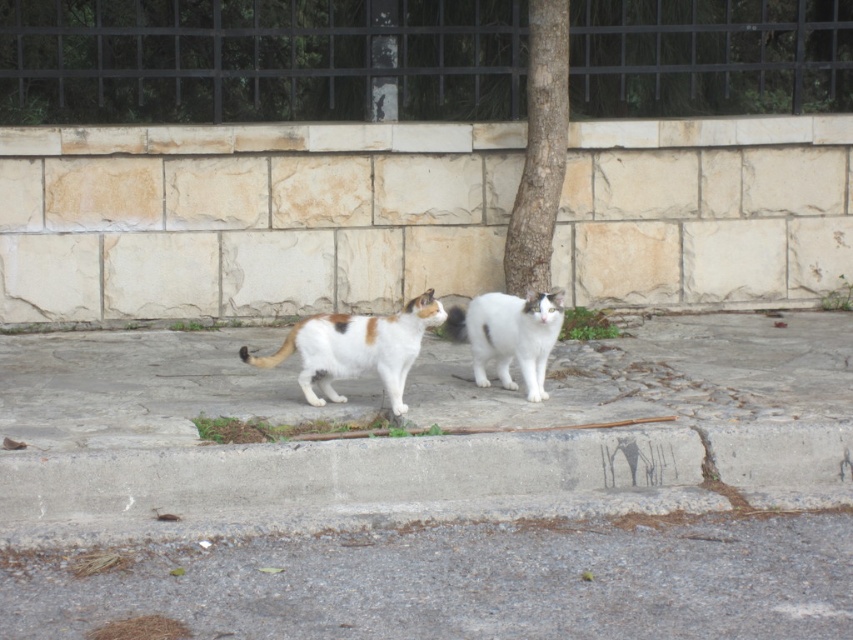
Question: Among these objects, which one is farthest from the camera?

Choices:
 (A) gray asphalt at lower center
 (B) smooth bark tree at center
 (C) white fluffy cat at center
 (D) white fur cat at center

Answer: (B)

Question: Can you confirm if gray asphalt at lower center is positioned above concrete at lower center?

Choices:
 (A) no
 (B) yes

Answer: (A)

Question: Which point appears closest to the camera in this image?

Choices:
 (A) (6, 522)
 (B) (492, 353)
 (C) (544, 154)
 (D) (366, 323)

Answer: (A)

Question: Is gray asphalt at lower center below white fur cat at center?

Choices:
 (A) yes
 (B) no

Answer: (A)

Question: Can you confirm if smooth bark tree at center is positioned below white fur cat at center?

Choices:
 (A) no
 (B) yes

Answer: (A)

Question: Which of the following is the closest to the observer?

Choices:
 (A) concrete at lower center
 (B) smooth bark tree at center

Answer: (A)